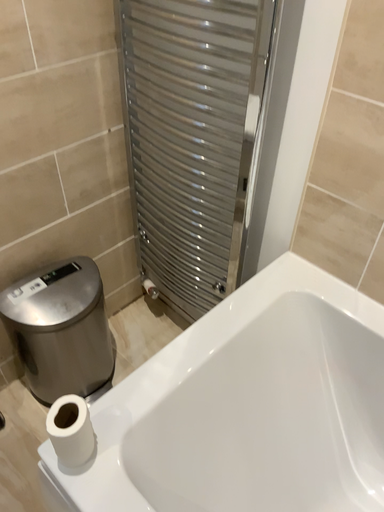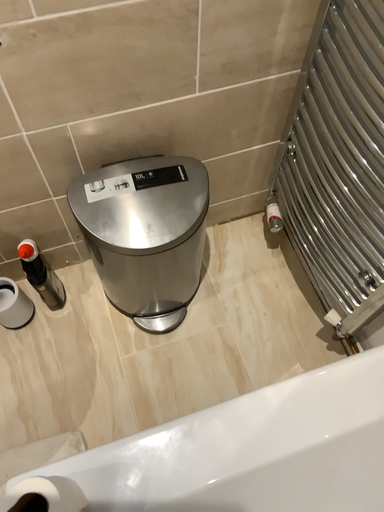
Question: How did the camera likely rotate when shooting the video?

Choices:
 (A) rotated downward
 (B) rotated upward

Answer: (A)